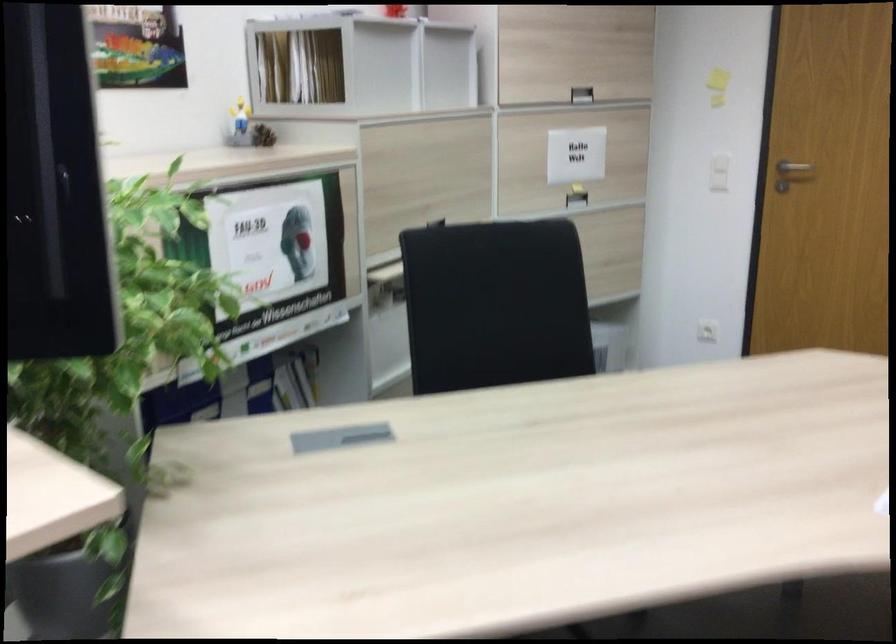
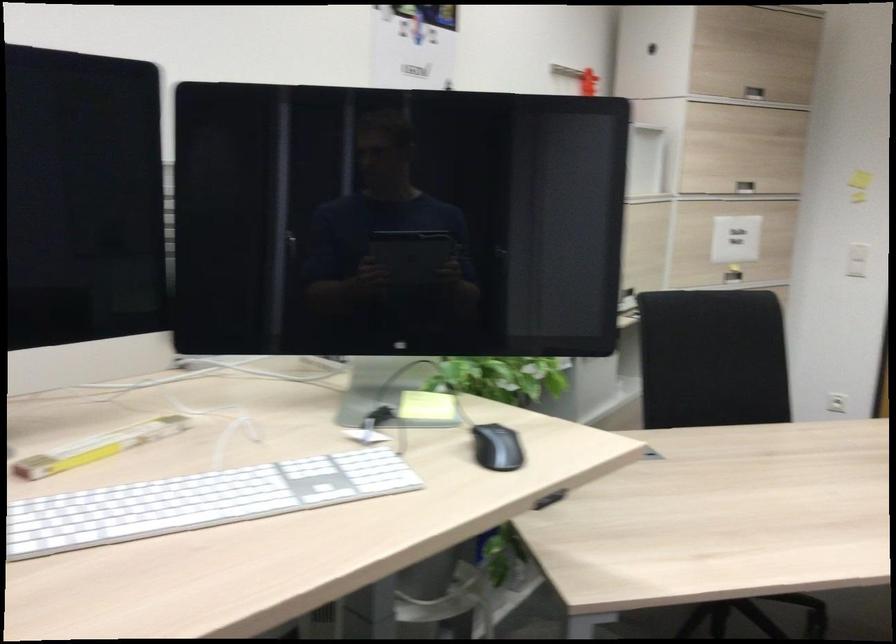
Find the pixel in the second image that matches point (565, 155) in the first image.

(736, 239)